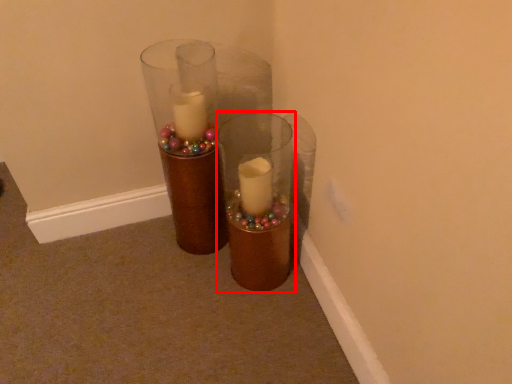
Question: From the image's perspective, considering the relative positions of vase (annotated by the red box) and vase in the image provided, where is vase (annotated by the red box) located with respect to the staircase?

Choices:
 (A) above
 (B) below

Answer: (B)